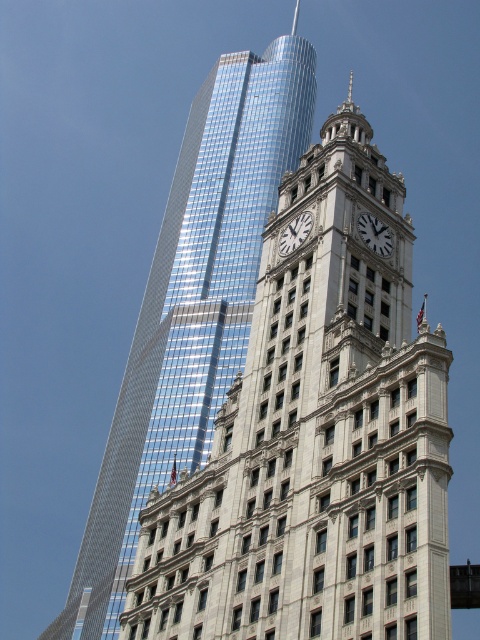
Question: Which of the following is the closest to the observer?

Choices:
 (A) shiny glass skyscraper at upper left
 (B) reflective glass skyscraper at upper left
 (C) white marble clock at upper center

Answer: (B)

Question: Which point appears closest to the camera in this image?

Choices:
 (A) tap(384, 193)
 (B) tap(286, 256)

Answer: (B)

Question: Does shiny glass skyscraper at upper left have a smaller size compared to white stone clock at upper center?

Choices:
 (A) yes
 (B) no

Answer: (B)

Question: Among these objects, which one is farthest from the camera?

Choices:
 (A) shiny glass skyscraper at upper left
 (B) reflective glass skyscraper at upper left
 (C) white marble clock at upper center
 (D) white stone clock at upper center

Answer: (A)

Question: Considering the relative positions of white marble clock at upper center and white stone clock at upper center in the image provided, where is white marble clock at upper center located with respect to white stone clock at upper center?

Choices:
 (A) left
 (B) right

Answer: (B)

Question: Is reflective glass skyscraper at upper left bigger than white stone clock at upper center?

Choices:
 (A) yes
 (B) no

Answer: (A)